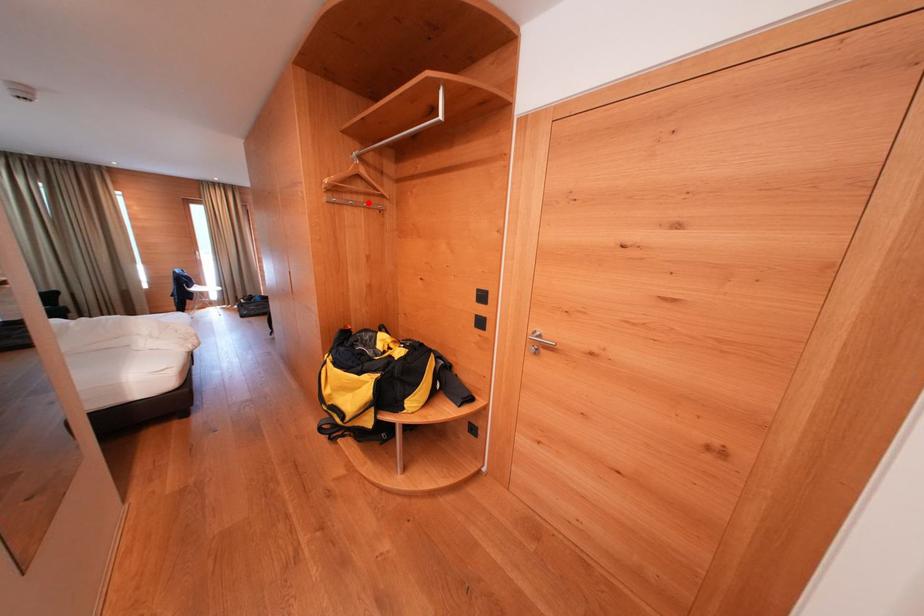
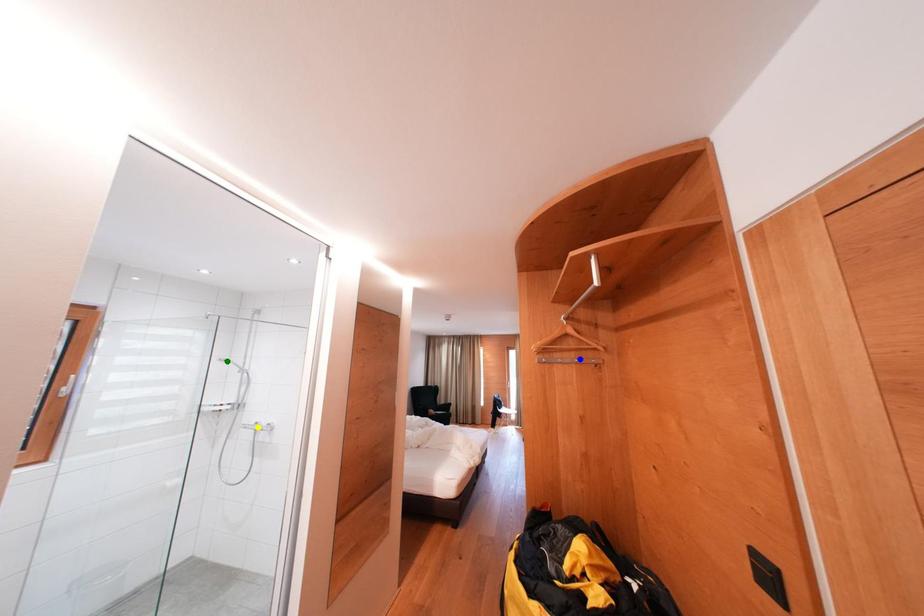
Question: I am providing you with two images of the same scene from different viewpoints. A red point is marked on the first image. You are given multiple points on the second image. Can you choose the point in image 2 that corresponds to the point in image 1?

Choices:
 (A) green point
 (B) blue point
 (C) yellow point

Answer: (B)